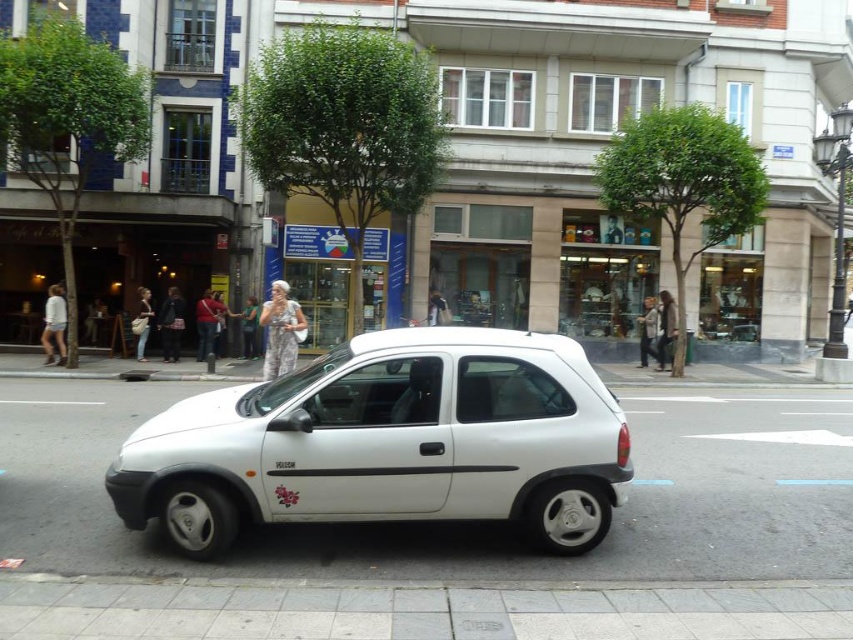
Is point (45, 333) closer to camera compared to point (215, 326)?

Yes, point (45, 333) is closer to viewer.

Is white fabric dress at center further to the viewer compared to red shirt at center?

No, white fabric dress at center is in front of red shirt at center.

This screenshot has height=640, width=853. I want to click on white fabric dress at center, so click(x=54, y=324).

Does light beige fabric dress at center appear on the right side of matte beige dress at center?

In fact, light beige fabric dress at center is to the left of matte beige dress at center.

At what (x,y) coordinates should I click in order to perform the action: click on light beige fabric dress at center. Please return your answer as a coordinate pair (x, y). The height and width of the screenshot is (640, 853). Looking at the image, I should click on (171, 324).

Describe the element at coordinates (281, 330) in the screenshot. I see `camouflage-patterned dress at center` at that location.

The image size is (853, 640). Find the location of `camouflage-patterned dress at center`. camouflage-patterned dress at center is located at coordinates (281, 330).